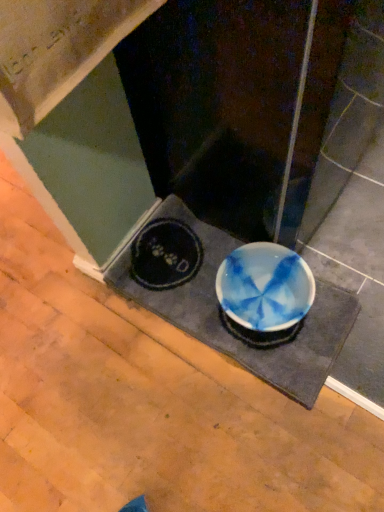
Find the location of `free space to the left of blue glossy bowl at center`. free space to the left of blue glossy bowl at center is located at coordinates (77, 352).